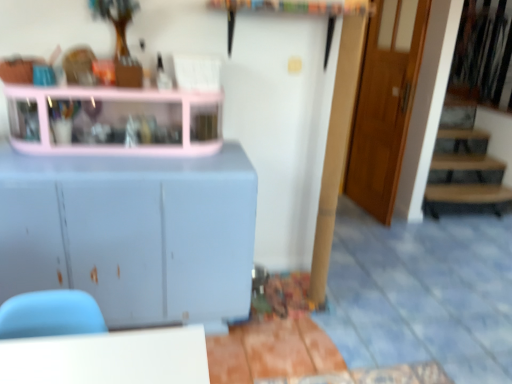
Question: Is matte white cabinet at left facing away from wooden door at right?

Choices:
 (A) no
 (B) yes

Answer: (A)

Question: Is wooden door at right inside matte white cabinet at left?

Choices:
 (A) no
 (B) yes

Answer: (A)

Question: Considering the relative positions of matte white cabinet at left and wooden door at right in the image provided, is matte white cabinet at left to the left of wooden door at right from the viewer's perspective?

Choices:
 (A) yes
 (B) no

Answer: (A)

Question: From the image's perspective, is matte white cabinet at left below wooden door at right?

Choices:
 (A) yes
 (B) no

Answer: (A)

Question: Are matte white cabinet at left and wooden door at right located far from each other?

Choices:
 (A) yes
 (B) no

Answer: (A)

Question: Considering the relative sizes of matte white cabinet at left and wooden door at right in the image provided, is matte white cabinet at left taller than wooden door at right?

Choices:
 (A) yes
 (B) no

Answer: (B)

Question: Is matte white cabinet at left surrounded by pink plastic shelf at upper left?

Choices:
 (A) yes
 (B) no

Answer: (B)

Question: Is pink plastic shelf at upper left taller than matte white cabinet at left?

Choices:
 (A) no
 (B) yes

Answer: (A)

Question: Is pink plastic shelf at upper left far from matte white cabinet at left?

Choices:
 (A) yes
 (B) no

Answer: (B)

Question: Considering the relative sizes of pink plastic shelf at upper left and matte white cabinet at left in the image provided, is pink plastic shelf at upper left thinner than matte white cabinet at left?

Choices:
 (A) no
 (B) yes

Answer: (B)

Question: Considering the relative sizes of pink plastic shelf at upper left and matte white cabinet at left in the image provided, is pink plastic shelf at upper left wider than matte white cabinet at left?

Choices:
 (A) no
 (B) yes

Answer: (A)

Question: Are pink plastic shelf at upper left and matte white cabinet at left beside each other?

Choices:
 (A) no
 (B) yes

Answer: (A)

Question: Is wooden door at right positioned with its back to pink plastic shelf at upper left?

Choices:
 (A) yes
 (B) no

Answer: (B)